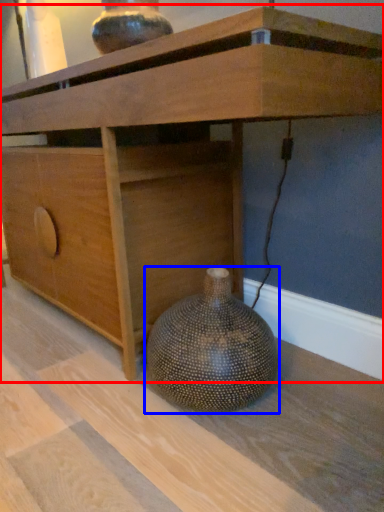
Question: Which object appears closest to the camera in this image, table (highlighted by a red box) or vase (highlighted by a blue box)?

Choices:
 (A) table
 (B) vase

Answer: (A)